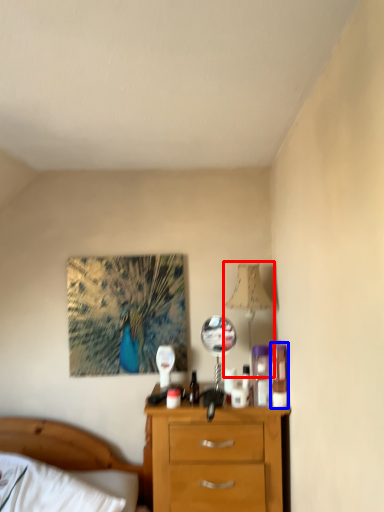
Question: Which object is closer to the camera taking this photo, table lamp (highlighted by a red box) or toiletry (highlighted by a blue box)?

Choices:
 (A) table lamp
 (B) toiletry

Answer: (B)